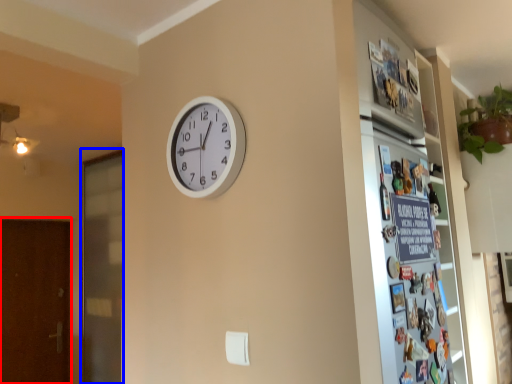
Question: Which of the following is the farthest to the observer, screen door (highlighted by a red box) or screen door (highlighted by a blue box)?

Choices:
 (A) screen door
 (B) screen door

Answer: (A)